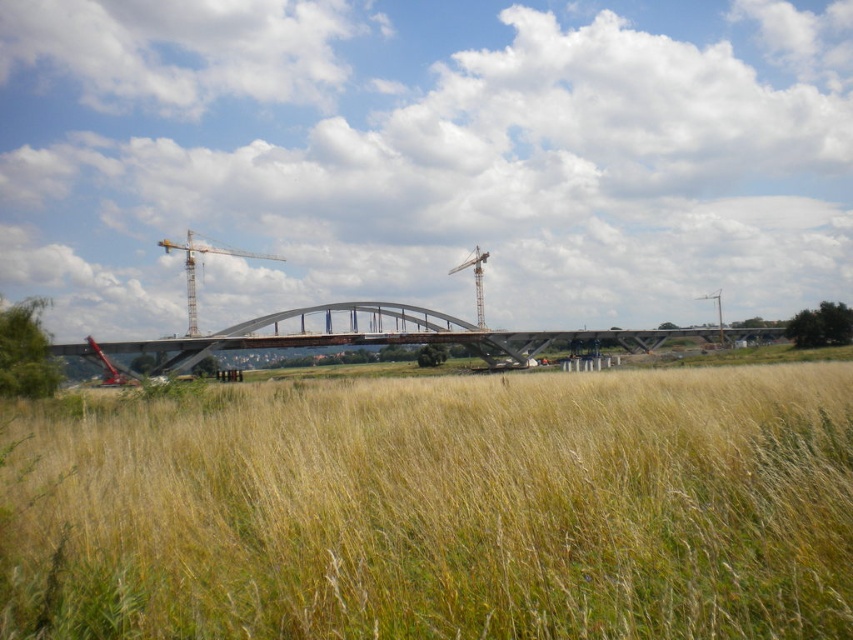
Consider the image. You are an engineer inspecting the construction site. You see the concrete bridge at center and the metallic gray crane at center. Which object is positioned to the left?

The metallic gray crane at center is positioned to the left of the concrete bridge at center.